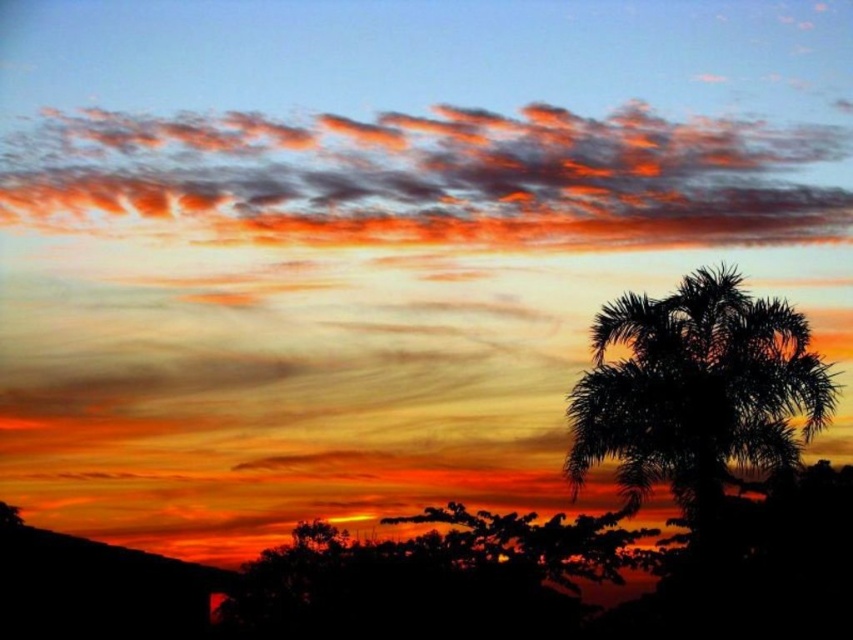
Can you confirm if glowing orange clouds at upper center is thinner than silhouette palm tree at right?

No, glowing orange clouds at upper center is not thinner than silhouette palm tree at right.

Does glowing orange clouds at upper center have a greater height compared to silhouette palm tree at right?

No.

Locate an element on the screen. glowing orange clouds at upper center is located at coordinates (424, 179).